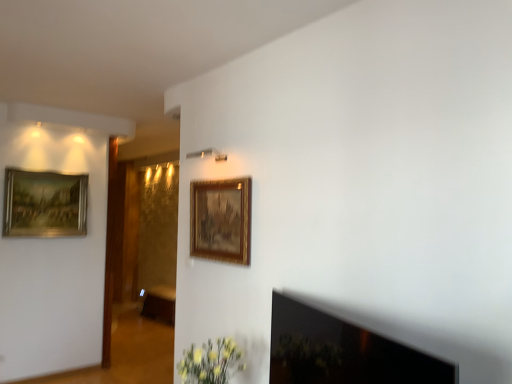
Find the location of a particular element. The height and width of the screenshot is (384, 512). free space above gold-framed painting at upper left, which ranks as the first picture frame in back-to-front order (from a real-world perspective) is located at coordinates (45, 168).